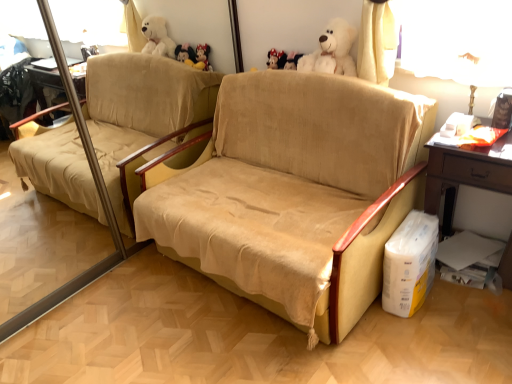
At what (x,y) coordinates should I click in order to perform the action: click on blank space situated above wooden table at right (from a real-world perspective). Please return your answer as a coordinate pair (x, y). Looking at the image, I should click on (479, 136).